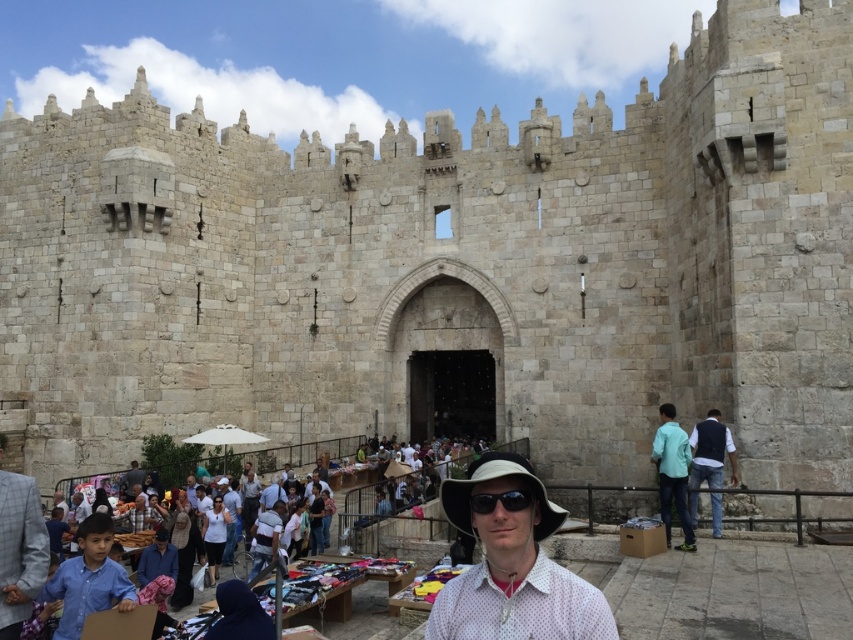
Question: Is teal fabric shirt at right bigger than dark blue vest at right?

Choices:
 (A) no
 (B) yes

Answer: (B)

Question: Can you confirm if gray checkered suit at lower left is positioned to the left of dark blue vest at right?

Choices:
 (A) yes
 (B) no

Answer: (A)

Question: Which of the following is the farthest from the observer?

Choices:
 (A) matte black dress at center
 (B) white textured hat at center
 (C) light brown leather jacket at center
 (D) white matte shirt at center

Answer: (C)

Question: Can you confirm if dark blue vest at right is bigger than black plastic sunglasses at center?

Choices:
 (A) yes
 (B) no

Answer: (A)

Question: Which point is farther to the camera?

Choices:
 (A) (221, 534)
 (B) (503, 499)
 (C) (13, 627)

Answer: (A)

Question: Which point appears farthest from the camera in this image?

Choices:
 (A) (142, 472)
 (B) (1, 436)
 (C) (192, 532)
 (D) (672, 464)

Answer: (B)